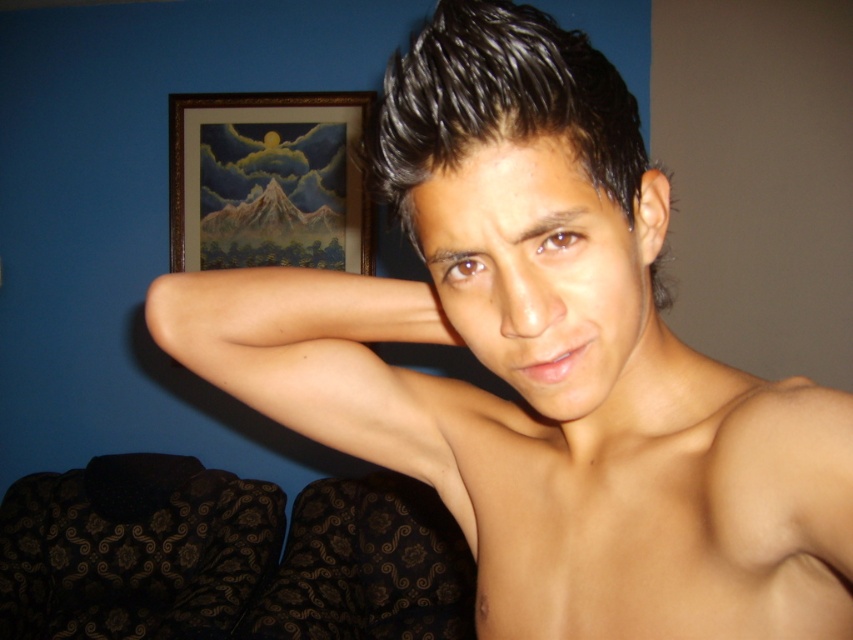
In the scene shown: Is skinny white skin at center closer to the viewer compared to skinny flesh at center?

Yes, it is in front of skinny flesh at center.

Between point (824, 566) and point (221, 353), which one is positioned behind?

Point (221, 353)

At what (x,y) coordinates should I click in order to perform the action: click on skinny white skin at center. Please return your answer as a coordinate pair (x, y). Looking at the image, I should click on (657, 509).

Does skinny flesh at center have a lesser width compared to black shiny hair at center?

Correct, skinny flesh at center's width is less than black shiny hair at center's.

Is skinny flesh at center positioned at the back of black shiny hair at center?

That is True.

The width and height of the screenshot is (853, 640). What do you see at coordinates (318, 358) in the screenshot?
I see `skinny flesh at center` at bounding box center [318, 358].

The height and width of the screenshot is (640, 853). I want to click on skinny flesh at center, so click(x=318, y=358).

Is skinny white skin at center thinner than wooden frame at upper center?

Yes.

Locate an element on the screen. This screenshot has height=640, width=853. skinny white skin at center is located at coordinates (657, 509).